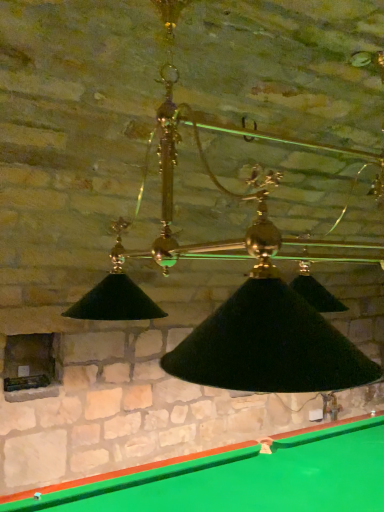
Where is `metallic brass lampshade at center`? The width and height of the screenshot is (384, 512). metallic brass lampshade at center is located at coordinates (236, 295).

This screenshot has width=384, height=512. What do you see at coordinates (236, 295) in the screenshot?
I see `metallic brass lampshade at center` at bounding box center [236, 295].

Locate an element on the screen. The height and width of the screenshot is (512, 384). metallic brass lampshade at center is located at coordinates (236, 295).